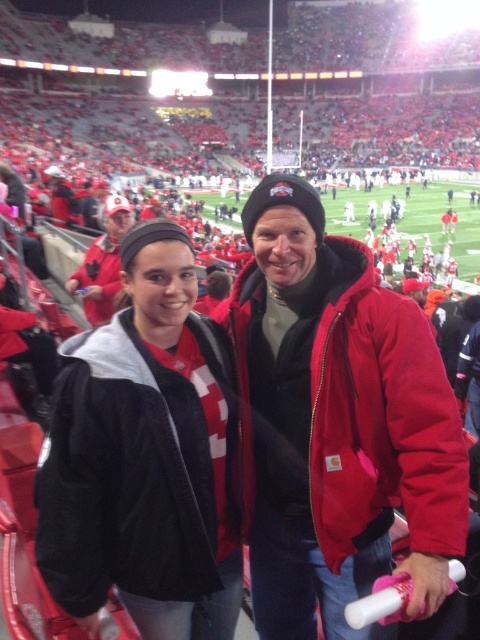
You are taking a photo of the two points in the stadium scene. Which point, point [460,460] or point [177,280], is nearer to the camera?

Point [460,460] is closer to the camera than point [177,280].

You are a photographer trying to capture a closeup of both jackets in the image. Since the red carhartt jacket at center and the matte red jacket at center are both at the center, which one would you zoom in on first to ensure both are in frame?

The red carhartt jacket at center is bigger than the matte red jacket at center, so you should zoom out slightly to include the larger red carhartt jacket at center first, then adjust to ensure the smaller matte red jacket at center is also in frame.